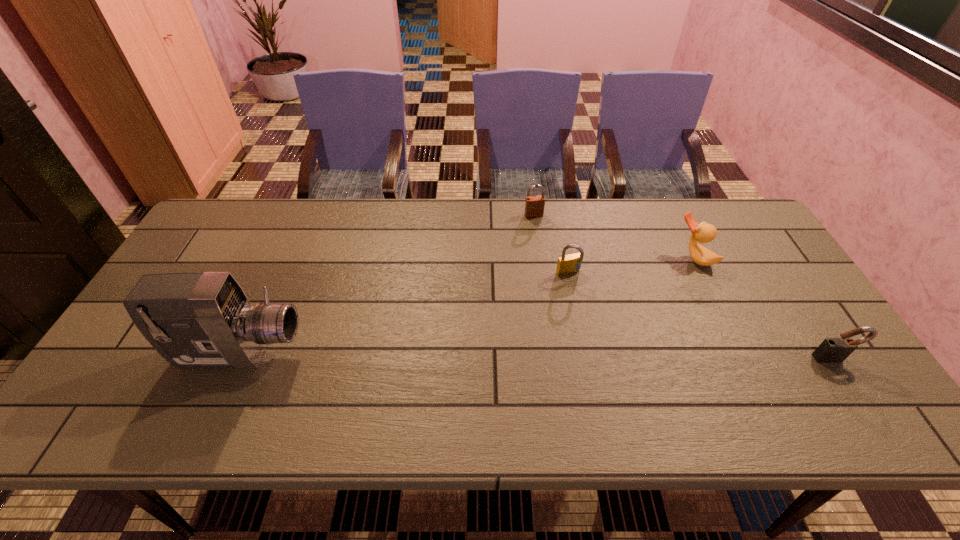
At what (x,y) coordinates should I click in order to perform the action: click on the tallest object. Please return your answer as a coordinate pair (x, y). The width and height of the screenshot is (960, 540). Looking at the image, I should click on (195, 320).

This screenshot has height=540, width=960. I want to click on camcorder, so click(195, 320).

Locate an element on the screen. The image size is (960, 540). the rightmost padlock is located at coordinates (832, 350).

At what (x,y) coordinates should I click in order to perform the action: click on the rightmost object. Please return your answer as a coordinate pair (x, y). Looking at the image, I should click on (832, 350).

The image size is (960, 540). Identify the location of the leftmost padlock. (534, 205).

You are a GUI agent. You are given a task and a screenshot of the screen. Output one action in this format:
    pyautogui.click(x=<x>, y=<y>)
    Task: Click on the farthest object
    
    Given the screenshot: What is the action you would take?
    pyautogui.click(x=534, y=205)

Identify the location of the fourth object from left to right. Image resolution: width=960 pixels, height=540 pixels. (703, 232).

Where is `the second nearest padlock`? the second nearest padlock is located at coordinates (569, 264).

The height and width of the screenshot is (540, 960). What are the coordinates of `the second padlock from right to left` in the screenshot? It's located at (569, 264).

The image size is (960, 540). Find the location of `vacant space situated 0.050m at the front of the camcorder, highlighting the lens`. vacant space situated 0.050m at the front of the camcorder, highlighting the lens is located at coordinates (323, 354).